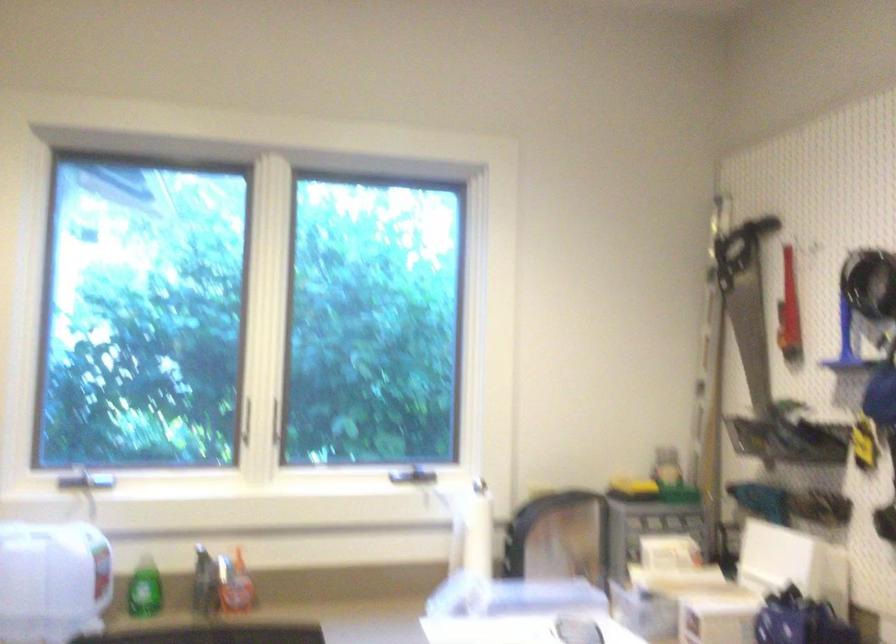
Find where to grip the red tool handle. Please return your answer as a coordinate pair (x, y).

(788, 287)